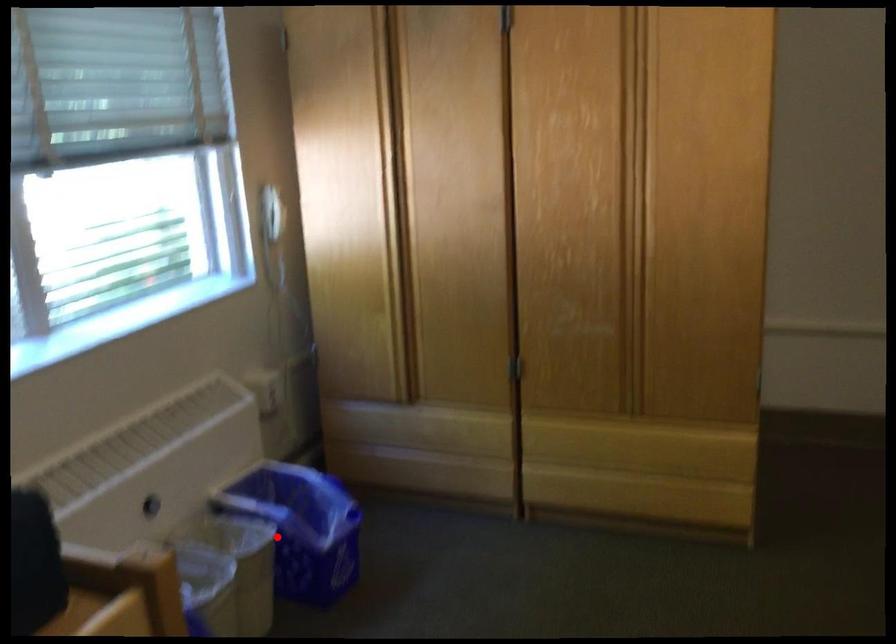
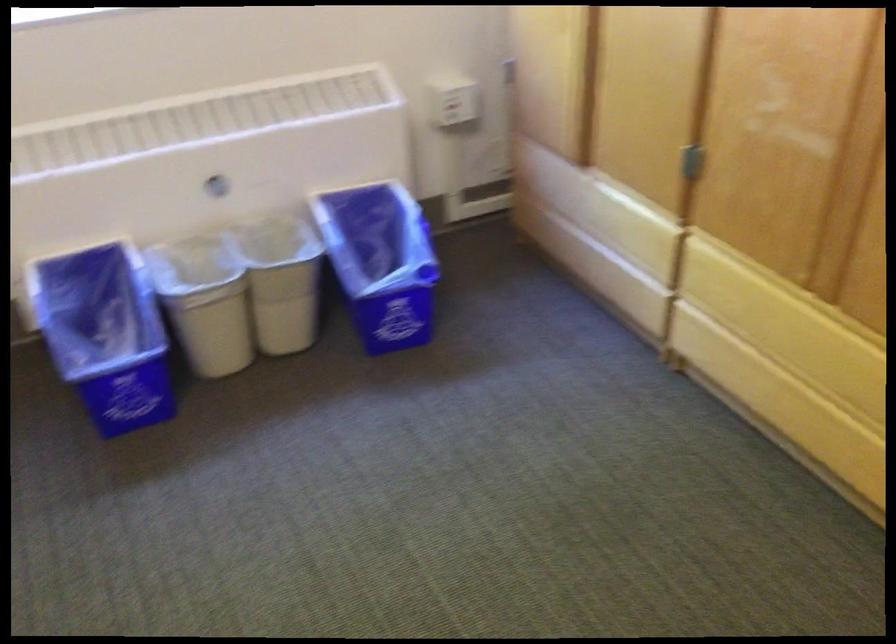
In the second image, find the point that corresponds to the highlighted location in the first image.

(380, 261)